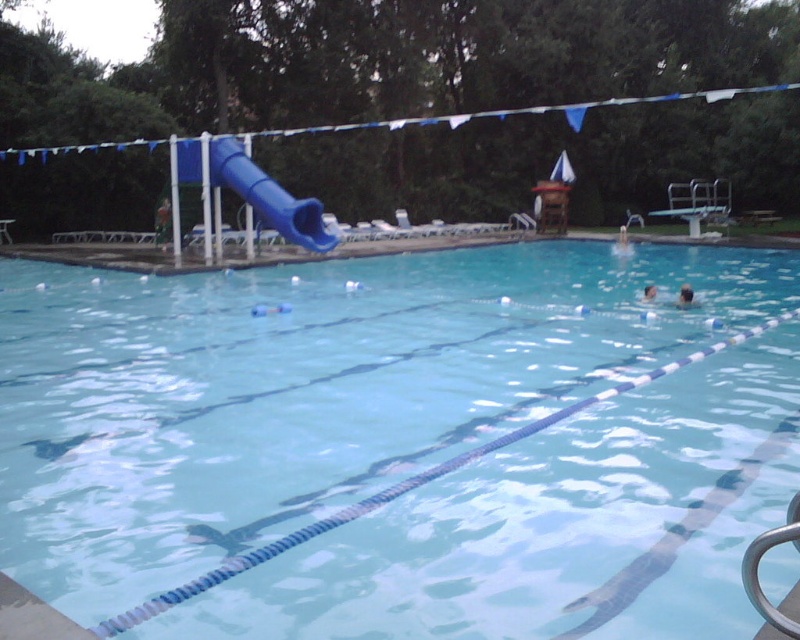
Measure the distance between point (694, 298) and camera.

Point (694, 298) is 37.99 feet from camera.

Does smooth skin head at upper right have a lesser width compared to smooth skin head at right?

In fact, smooth skin head at upper right might be wider than smooth skin head at right.

What do you see at coordinates (686, 298) in the screenshot? I see `smooth skin head at upper right` at bounding box center [686, 298].

Locate an element on the screen. The width and height of the screenshot is (800, 640). smooth skin head at upper right is located at coordinates (686, 298).

Does blue plastic slide at left have a lesser width compared to white matte person at upper center?

Incorrect, blue plastic slide at left's width is not less than white matte person at upper center's.

Does blue plastic slide at left have a greater height compared to white matte person at upper center?

Indeed, blue plastic slide at left has a greater height compared to white matte person at upper center.

The width and height of the screenshot is (800, 640). In order to click on blue plastic slide at left in this screenshot , I will do `click(268, 196)`.

Locate an element on the screen. This screenshot has height=640, width=800. blue plastic slide at left is located at coordinates (268, 196).

Which of these two, white matte person at upper center or smooth skin head at upper right, stands shorter?

white matte person at upper center

Does point (626, 234) come in front of point (680, 289)?

No, (626, 234) is behind (680, 289).

Identify the location of white matte person at upper center. This screenshot has width=800, height=640. (622, 243).